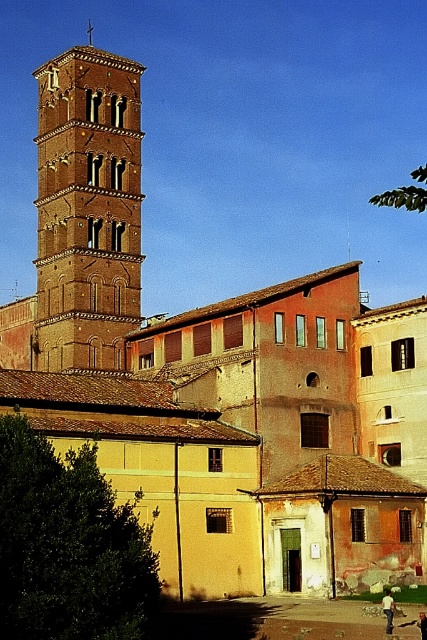
Question: Which object appears closest to the camera in this image?

Choices:
 (A) brick/tiled bell tower at center-left
 (B) dark blue jeans at lower right
 (C) white cotton shirt at lower right

Answer: (B)

Question: Which point appears farthest from the camera in this image?

Choices:
 (A) (421, 637)
 (B) (394, 605)

Answer: (B)

Question: Is brick/tiled bell tower at center-left thinner than dark blue jeans at lower right?

Choices:
 (A) no
 (B) yes

Answer: (A)

Question: Which object is closer to the camera taking this photo?

Choices:
 (A) brick/tiled bell tower at center-left
 (B) white cotton shirt at lower right
 (C) dark blue jeans at lower right

Answer: (C)

Question: Does white cotton shirt at lower right appear under dark blue jeans at lower right?

Choices:
 (A) no
 (B) yes

Answer: (B)

Question: Is brick/tiled bell tower at center-left to the right of white cotton shirt at lower right from the viewer's perspective?

Choices:
 (A) yes
 (B) no

Answer: (B)